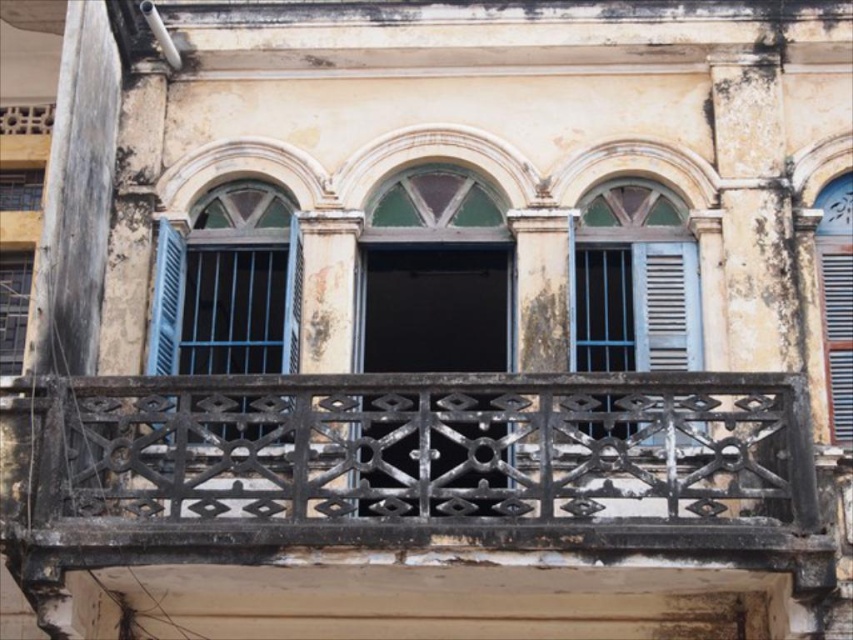
You are an architect designing a new building and want to incorporate elements from this old building. You have a limited space where the black wrought iron at center and green glass window at center must fit side by side. Given their widths, which element should be placed first to ensure they both fit without overlapping?

The black wrought iron at center has a smaller width than the green glass window at center, so place the black wrought iron at center first to accommodate both elements within the limited space.

You are an architect inspecting the old building. You notice the black wrought iron at center and the green glass window at center. Which object is closer to you based on their positions?

The black wrought iron at center is in front of the green glass window at center, so it is closer to you.

You are standing in front of the old building. There is a point marked at coordinates (x=228, y=285). Which object does this point belong to?

The point at coordinates (x=228, y=285) is on the matte blue wooden window at center.